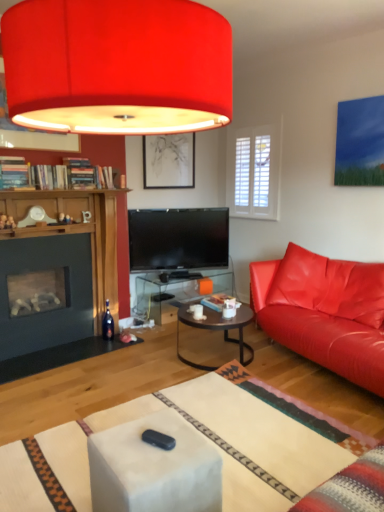
Question: Would you say matte black picture frame at upper center is outside dark brown glass coffee table at center?

Choices:
 (A) yes
 (B) no

Answer: (A)

Question: Is matte black picture frame at upper center oriented away from dark brown glass coffee table at center?

Choices:
 (A) no
 (B) yes

Answer: (A)

Question: Can you confirm if matte black picture frame at upper center is thinner than dark brown glass coffee table at center?

Choices:
 (A) yes
 (B) no

Answer: (A)

Question: Is matte black picture frame at upper center aimed at dark brown glass coffee table at center?

Choices:
 (A) yes
 (B) no

Answer: (B)

Question: From a real-world perspective, is matte black picture frame at upper center located beneath dark brown glass coffee table at center?

Choices:
 (A) no
 (B) yes

Answer: (A)

Question: From their relative heights in the image, would you say matte black picture frame at upper center is taller or shorter than matte leather couch at right?

Choices:
 (A) short
 (B) tall

Answer: (A)

Question: Is matte black picture frame at upper center bigger or smaller than matte leather couch at right?

Choices:
 (A) big
 (B) small

Answer: (B)

Question: Is matte black picture frame at upper center spatially inside matte leather couch at right, or outside of it?

Choices:
 (A) outside
 (B) inside

Answer: (A)

Question: From a real-world perspective, is matte black picture frame at upper center positioned above or below matte leather couch at right?

Choices:
 (A) below
 (B) above

Answer: (B)

Question: Is dark glass wine bottle at lower left wider or thinner than matte red lampshade at upper center?

Choices:
 (A) thin
 (B) wide

Answer: (A)

Question: Is dark glass wine bottle at lower left inside or outside of matte red lampshade at upper center?

Choices:
 (A) inside
 (B) outside

Answer: (B)

Question: In the image, is dark glass wine bottle at lower left positioned in front of or behind matte red lampshade at upper center?

Choices:
 (A) front
 (B) behind

Answer: (B)

Question: In terms of size, does dark glass wine bottle at lower left appear bigger or smaller than matte red lampshade at upper center?

Choices:
 (A) small
 (B) big

Answer: (A)

Question: Is dark glass wine bottle at lower left situated inside dark brown glass coffee table at center or outside?

Choices:
 (A) inside
 (B) outside

Answer: (B)

Question: Considering their positions, is dark glass wine bottle at lower left located in front of or behind dark brown glass coffee table at center?

Choices:
 (A) behind
 (B) front

Answer: (A)